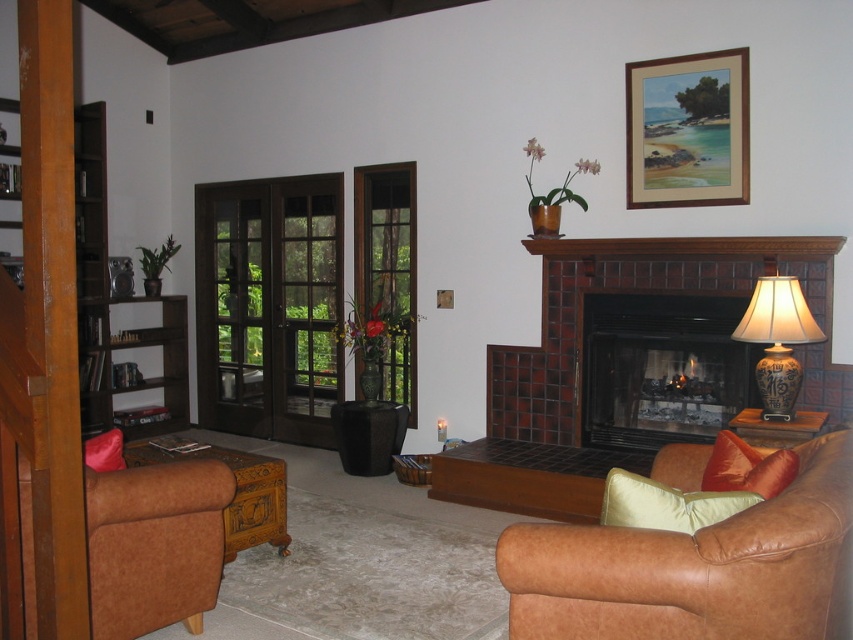
Question: Which of these objects is positioned farthest from the wooden picture frame at upper right?

Choices:
 (A) light beige fabric pillow at lower right
 (B) brown leather ottoman at lower left

Answer: (B)

Question: Which point is farther to the camera?

Choices:
 (A) (653, 525)
 (B) (253, 522)
 (C) (341, 266)
 (D) (747, 484)

Answer: (C)

Question: Is brown leather couch at lower right further to camera compared to brown wood french doors at left?

Choices:
 (A) yes
 (B) no

Answer: (B)

Question: Is brown leather ottoman at lower left thinner than light beige fabric pillow at lower right?

Choices:
 (A) no
 (B) yes

Answer: (A)

Question: Is black tile fireplace at center behind light beige fabric pillow at lower right?

Choices:
 (A) no
 (B) yes

Answer: (B)

Question: Which point appears closest to the camera in this image?

Choices:
 (A) [271, 460]
 (B) [817, 504]
 (C) [630, 502]

Answer: (B)